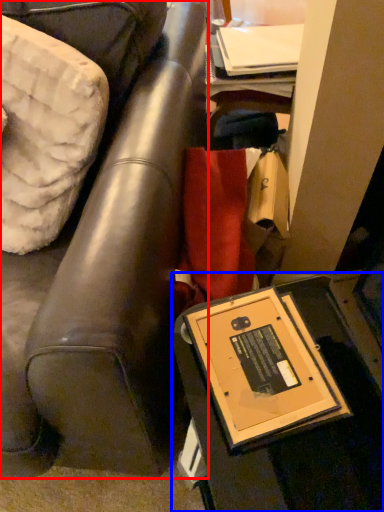
Question: Which point is closer to the camera, furniture (highlighted by a red box) or table (highlighted by a blue box)?

Choices:
 (A) furniture
 (B) table

Answer: (A)